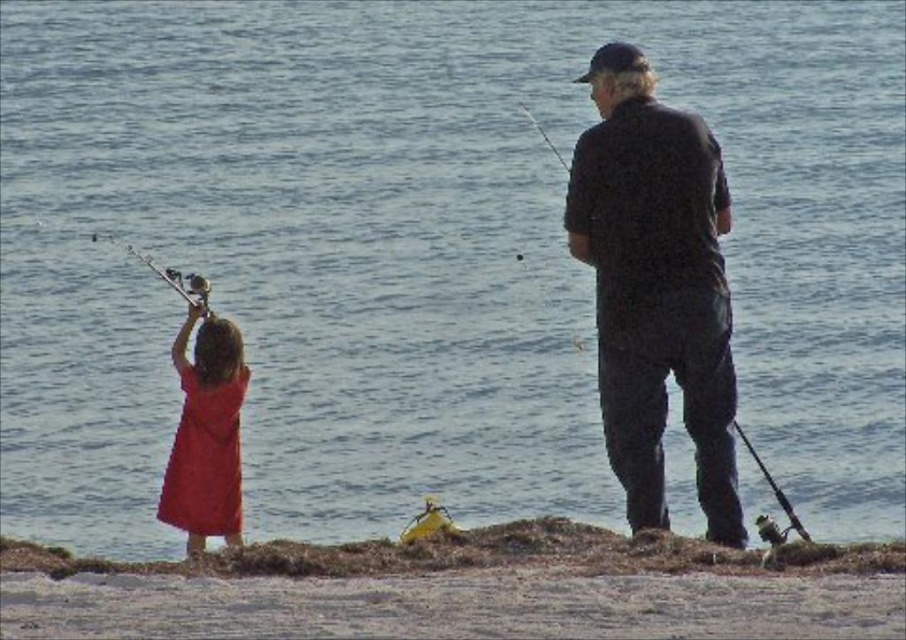
Question: Observing the image, what is the correct spatial positioning of brown seaweed at lower center in reference to matte red dress at left?

Choices:
 (A) left
 (B) right

Answer: (B)

Question: Considering the relative positions of brown seaweed at lower center and matte red dress at left in the image provided, where is brown seaweed at lower center located with respect to matte red dress at left?

Choices:
 (A) above
 (B) below

Answer: (B)

Question: Estimate the real-world distances between objects in this image. Which object is farther from the matte red dress at left?

Choices:
 (A) dark gray cotton shirt at right
 (B) brown seaweed at lower center

Answer: (B)

Question: Is dark gray cotton shirt at right wider than matte red dress at left?

Choices:
 (A) no
 (B) yes

Answer: (B)

Question: Which object is positioned farthest from the dark gray cotton shirt at right?

Choices:
 (A) matte red dress at left
 (B) brown seaweed at lower center

Answer: (A)

Question: Which object appears closest to the camera in this image?

Choices:
 (A) dark gray cotton shirt at right
 (B) matte red dress at left

Answer: (A)